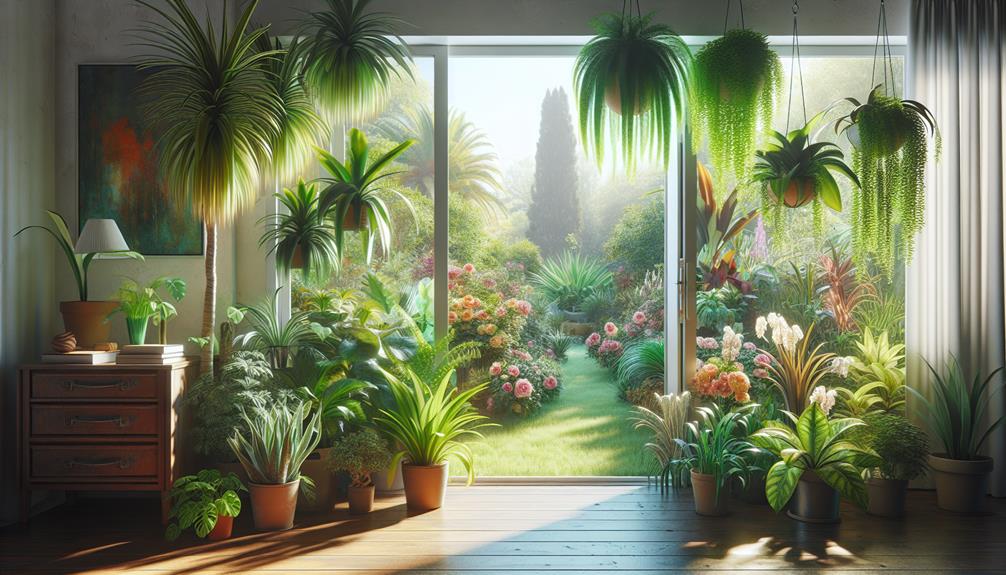
You are a GUI agent. You are given a task and a screenshot of the screen. Output one action in this format:
    pyautogui.click(x=<x>, y=<y>)
    Task: Click on the floor planks
    The image size is (1006, 575).
    Given the screenshot: What is the action you would take?
    pyautogui.click(x=525, y=568), pyautogui.click(x=515, y=546), pyautogui.click(x=516, y=534), pyautogui.click(x=550, y=526), pyautogui.click(x=556, y=516), pyautogui.click(x=556, y=499), pyautogui.click(x=556, y=490)